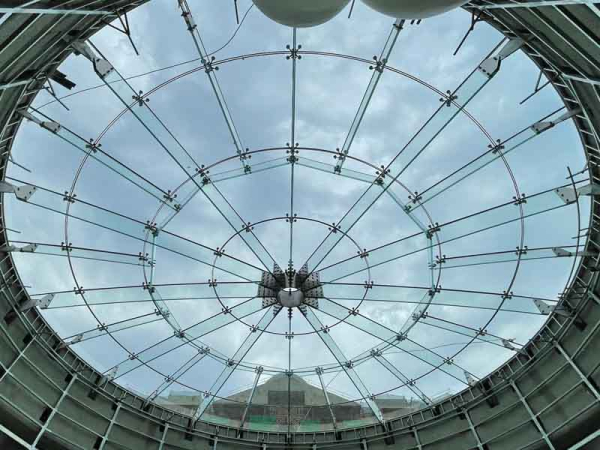
At what (x,y) coordinates should I click in order to perform the action: click on structure walls. Please return your answer as a coordinate pair (x, y). Looking at the image, I should click on (568, 33), (475, 443), (39, 403), (35, 39).